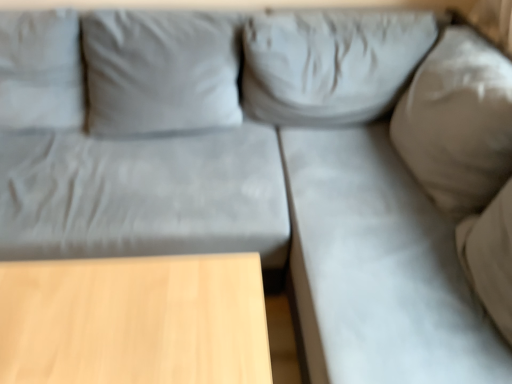
Identify the location of free space above light wood table at lower left (from a real-world perspective). This screenshot has width=512, height=384. (113, 322).